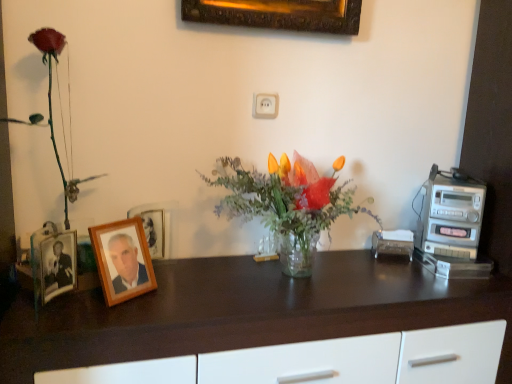
Identify the location of empty space that is in between clear glass vase at center and silver metallic stereo at right. (393, 273).